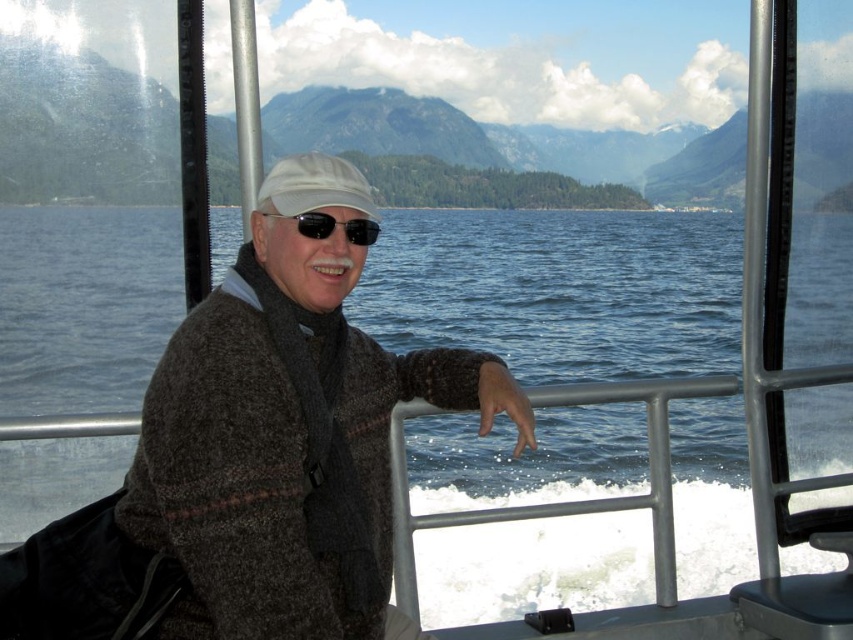
Question: Is knitted sweater at center bigger than black reflective sunglasses at center?

Choices:
 (A) no
 (B) yes

Answer: (B)

Question: Which of the following is the closest to the observer?

Choices:
 (A) white matte cap at center
 (B) knitted sweater at center

Answer: (B)

Question: Which object is positioned closest to the white matte cap at center?

Choices:
 (A) black reflective sunglasses at center
 (B) knitted sweater at center

Answer: (A)

Question: Which point appears closest to the camera in this image?

Choices:
 (A) (352, 241)
 (B) (339, 564)

Answer: (B)

Question: Can you confirm if knitted sweater at center is positioned above white matte cap at center?

Choices:
 (A) no
 (B) yes

Answer: (A)

Question: Where is knitted sweater at center located in relation to white matte cap at center in the image?

Choices:
 (A) left
 (B) right

Answer: (B)